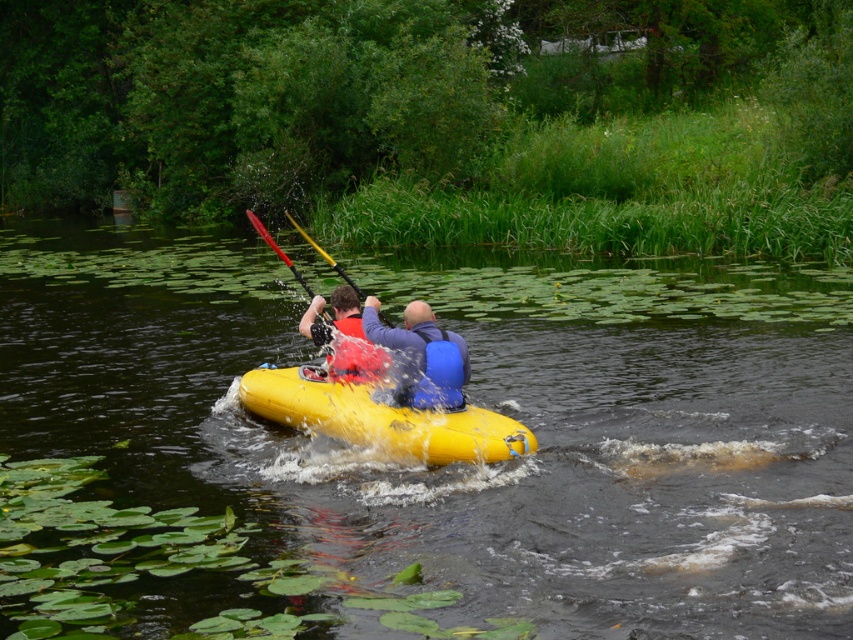
Is point (376, 330) less distant than point (358, 296)?

Yes, point (376, 330) is in front of point (358, 296).

Who is positioned more to the right, blue padded life vest at center or yellow plastic paddle at center?

Positioned to the right is blue padded life vest at center.

Is point (428, 380) positioned before point (393, 324)?

Yes.

Identify the location of blue padded life vest at center. The width and height of the screenshot is (853, 640). (421, 356).

Who is positioned more to the left, yellow rubber boat at center or yellow plastic paddle at center?

yellow plastic paddle at center

Does yellow rubber boat at center have a smaller size compared to yellow plastic paddle at center?

Incorrect, yellow rubber boat at center is not smaller in size than yellow plastic paddle at center.

You are a GUI agent. You are given a task and a screenshot of the screen. Output one action in this format:
    pyautogui.click(x=<x>, y=<y>)
    Task: Click on the yellow rubber boat at center
    
    Given the screenshot: What is the action you would take?
    pyautogui.click(x=480, y=404)

This screenshot has width=853, height=640. What are the coordinates of `yellow rubber boat at center` in the screenshot? It's located at (480, 404).

Is point (430, 292) positioned in front of point (268, 243)?

No, it is behind (268, 243).

Which is more to the left, yellow rubber boat at center or red plastic paddle at center?

Positioned to the left is red plastic paddle at center.

Is point (112, 422) positioned after point (273, 246)?

Yes.

In order to click on yellow rubber boat at center in this screenshot , I will do `click(480, 404)`.